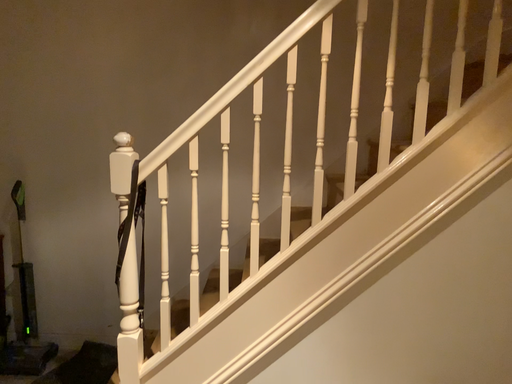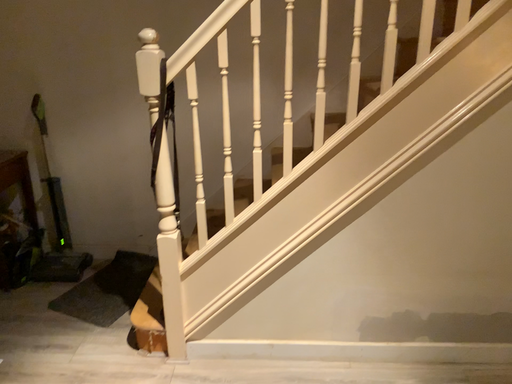
Question: How did the camera likely rotate when shooting the video?

Choices:
 (A) rotated downward
 (B) rotated upward

Answer: (A)